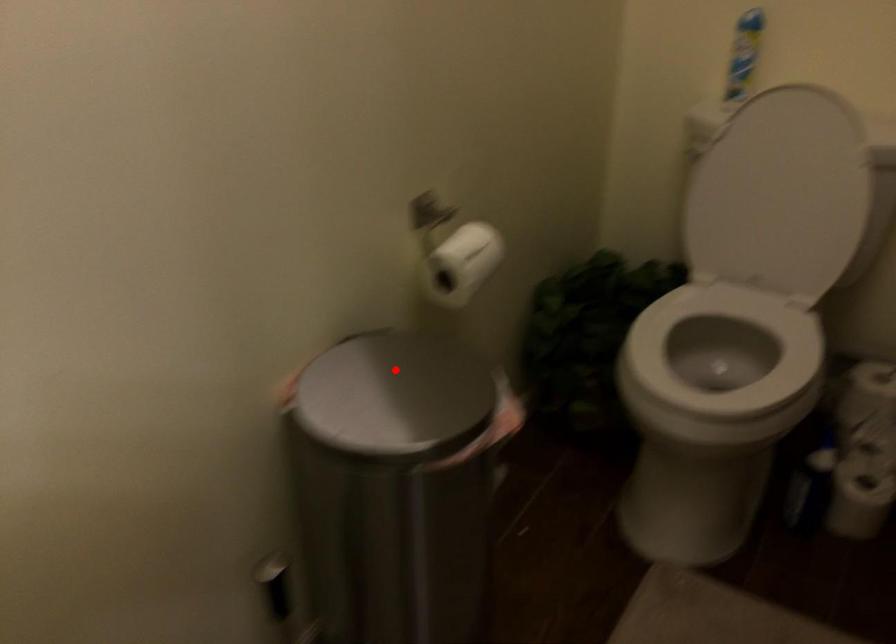
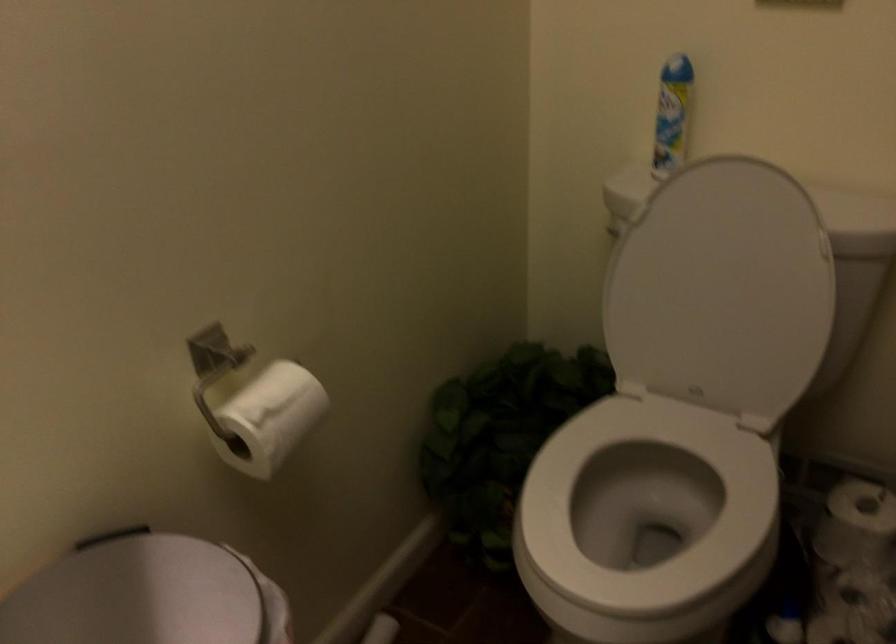
Find the pixel in the second image that matches the highlighted location in the first image.

(138, 594)